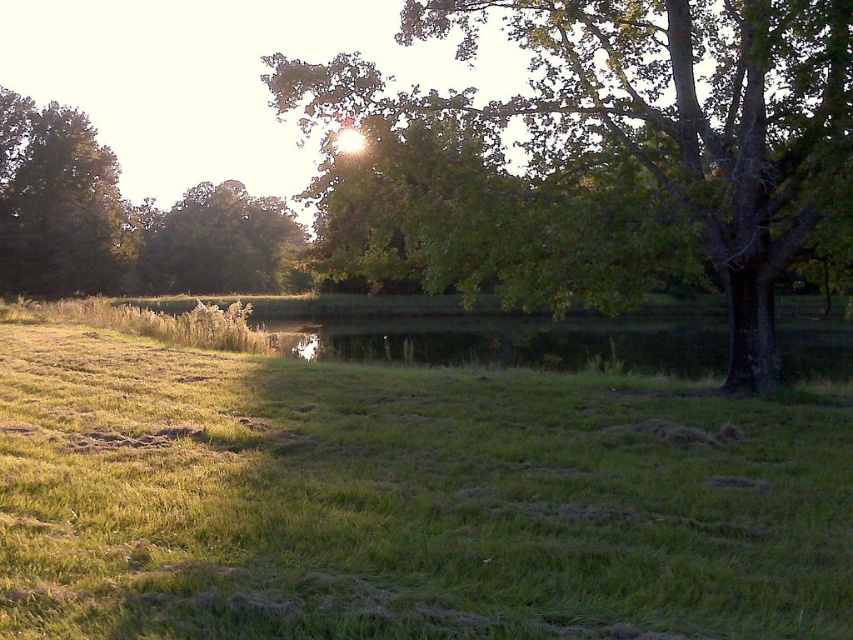
You are a gardener who wants to plant a new flower bed. You have two options for locations in the scene shown. The first is the green grassy at center and the second is the green leafy tree at upper left. Which location would provide more sunlight for the flowers?

The green grassy at center would provide more sunlight for the flowers because it is shorter than the green leafy tree at upper left, which may block some sunlight.

You are standing in the middle of the grassy field and want to walk towards the green leafy tree at left and the green leafy tree at upper left. Which tree should you head towards if you want to walk the shortest distance?

You should head towards the green leafy tree at left because it is positioned to the left of the green leafy tree at upper left, making it closer to your current position in the middle of the field.

You are standing in the middle of the grassy field and looking towards the large tree on the right. Which tree, the green leafy tree at upper right or the green leafy tree at left, is positioned higher in the sky from your viewpoint?

The green leafy tree at upper right is positioned higher in the sky from your viewpoint because it is located above the green leafy tree at left.